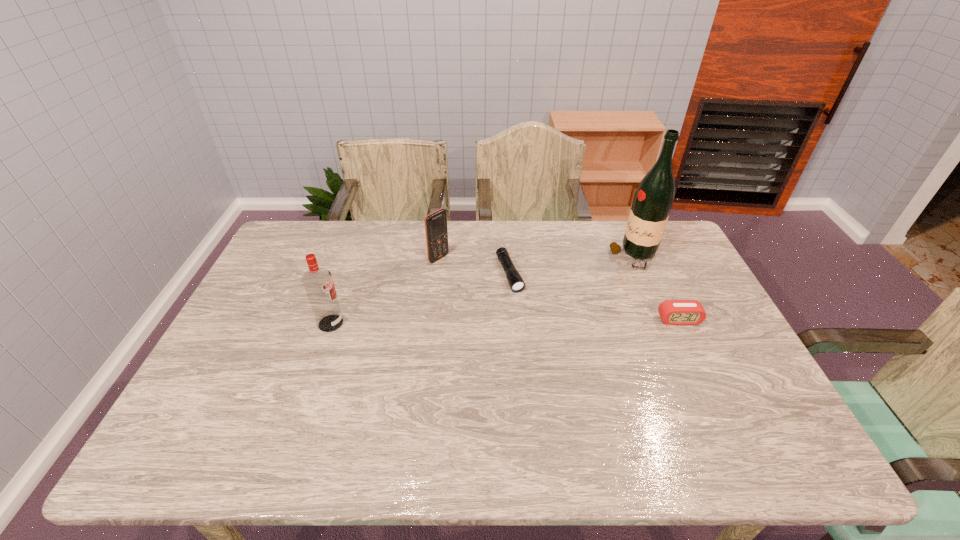
Where is `the fourth shortest object`? the fourth shortest object is located at coordinates click(318, 283).

Where is `vodka`? The height and width of the screenshot is (540, 960). vodka is located at coordinates (318, 283).

Where is `the second shortest object`? This screenshot has width=960, height=540. the second shortest object is located at coordinates (672, 312).

Find the location of a particular element. This screenshot has height=540, width=960. wine bottle is located at coordinates (654, 197).

The height and width of the screenshot is (540, 960). Find the location of `the second object from left to right`. the second object from left to right is located at coordinates (436, 230).

Identify the location of the third shortest object. (436, 230).

The height and width of the screenshot is (540, 960). Find the location of `flashlight`. flashlight is located at coordinates (517, 284).

Identify the location of the third object from left to right. Image resolution: width=960 pixels, height=540 pixels. (517, 284).

Where is `vacant space located 0.230m on the front label of the vodka`? The width and height of the screenshot is (960, 540). vacant space located 0.230m on the front label of the vodka is located at coordinates (425, 323).

Find the location of a particular element. This screenshot has height=540, width=960. vacant space located 0.080m on the front-facing side of the fourth tallest object is located at coordinates (692, 348).